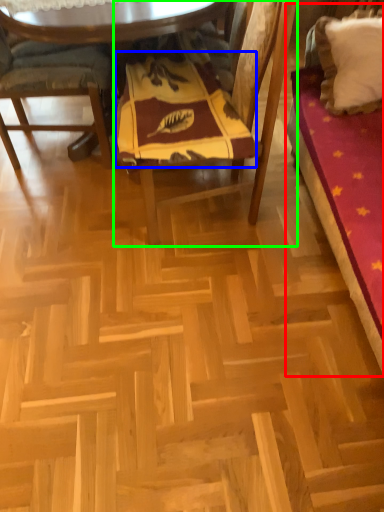
Question: Estimate the real-world distances between objects in this image. Which object is closer to bed (highlighted by a red box), blanket (highlighted by a blue box) or chair (highlighted by a green box)?

Choices:
 (A) blanket
 (B) chair

Answer: (B)